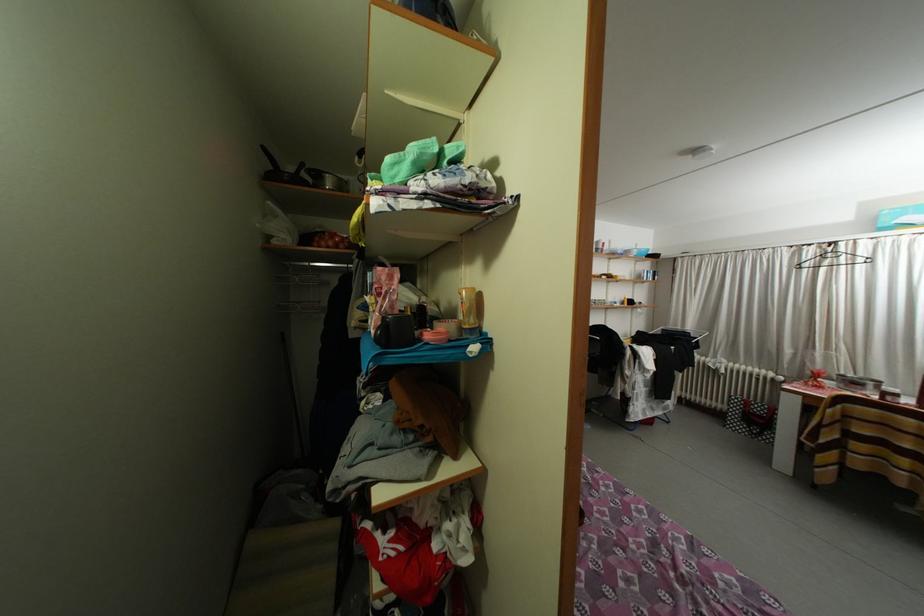
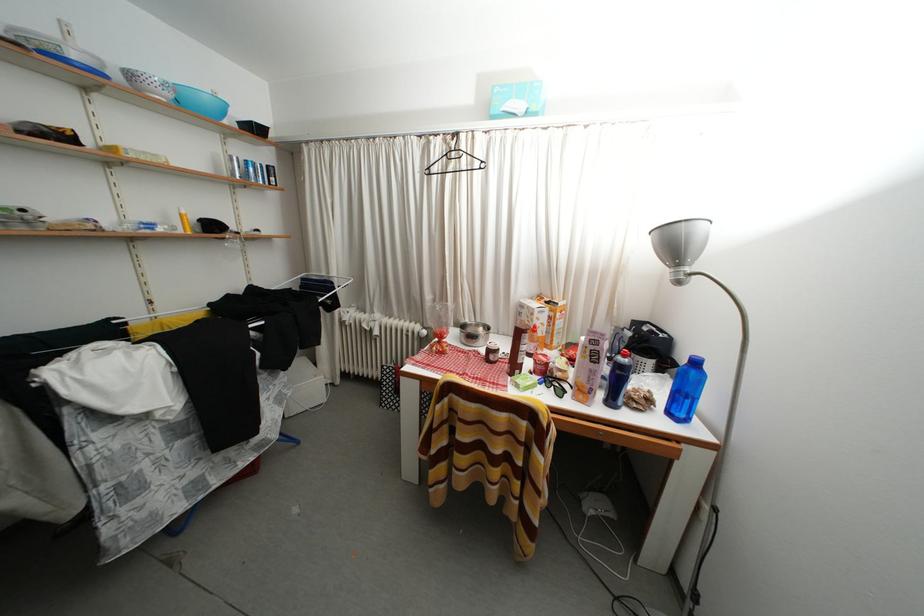
Where in the second image is the point corresponding to point (835, 387) from the first image?

(460, 342)